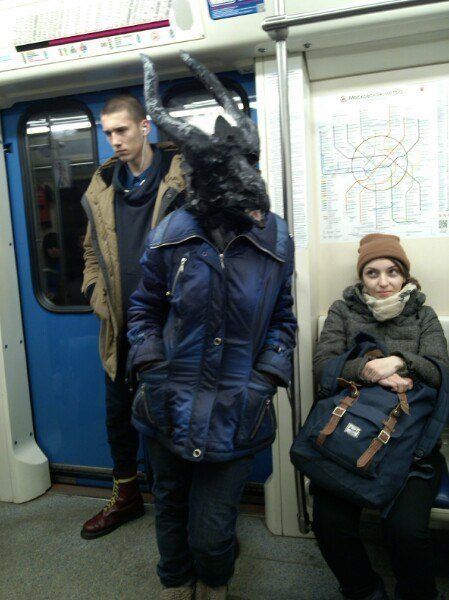
Identify the location of blue door. Image resolution: width=449 pixels, height=600 pixels. (94, 370).